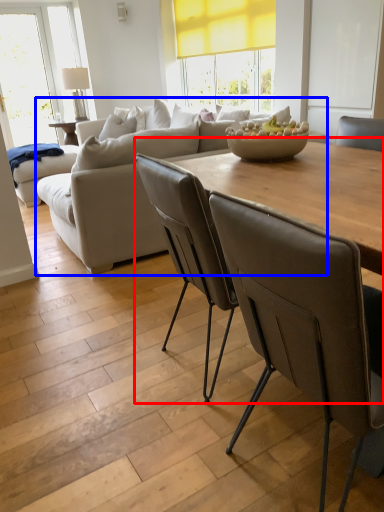
Question: Which object is further to the camera taking this photo, table (highlighted by a red box) or studio couch (highlighted by a blue box)?

Choices:
 (A) table
 (B) studio couch

Answer: (B)